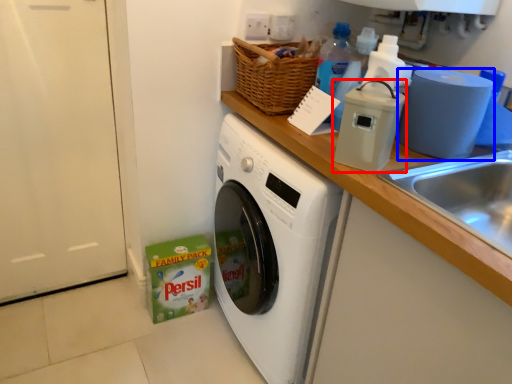
Question: Which object appears closest to the camera in this image, appliance (highlighted by a red box) or toilet paper (highlighted by a blue box)?

Choices:
 (A) appliance
 (B) toilet paper

Answer: (A)